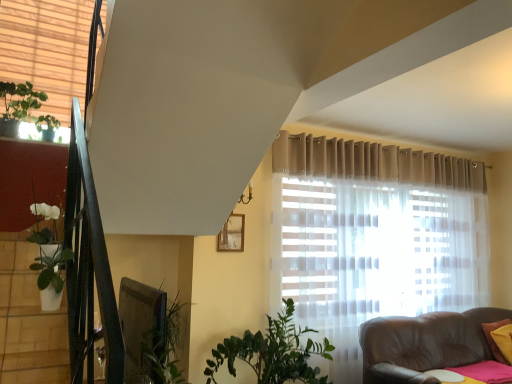
Question: Can you confirm if yellow fabric pillow at lower right is bigger than wooden frame at upper center?

Choices:
 (A) yes
 (B) no

Answer: (A)

Question: Is wooden frame at upper center a part of yellow fabric pillow at lower right?

Choices:
 (A) yes
 (B) no

Answer: (B)

Question: Does yellow fabric pillow at lower right come behind wooden frame at upper center?

Choices:
 (A) no
 (B) yes

Answer: (B)

Question: From a real-world perspective, is yellow fabric pillow at lower right physically below wooden frame at upper center?

Choices:
 (A) yes
 (B) no

Answer: (A)

Question: From the image's perspective, is yellow fabric pillow at lower right under wooden frame at upper center?

Choices:
 (A) yes
 (B) no

Answer: (A)

Question: In terms of size, does wooden frame at upper center appear bigger or smaller than green matte plant at upper left?

Choices:
 (A) big
 (B) small

Answer: (B)

Question: Choose the correct answer: Is wooden frame at upper center inside green matte plant at upper left or outside it?

Choices:
 (A) inside
 (B) outside

Answer: (B)

Question: Is wooden frame at upper center to the left or to the right of green matte plant at upper left in the image?

Choices:
 (A) left
 (B) right

Answer: (B)

Question: Is wooden frame at upper center in front of or behind green matte plant at upper left in the image?

Choices:
 (A) behind
 (B) front

Answer: (A)

Question: Based on their sizes in the image, would you say yellow fabric pillow at lower right is bigger or smaller than beige fabric blinds at upper left?

Choices:
 (A) small
 (B) big

Answer: (A)

Question: Considering the positions of yellow fabric pillow at lower right and beige fabric blinds at upper left in the image, is yellow fabric pillow at lower right taller or shorter than beige fabric blinds at upper left?

Choices:
 (A) short
 (B) tall

Answer: (A)

Question: Based on their positions, is yellow fabric pillow at lower right located to the left or right of beige fabric blinds at upper left?

Choices:
 (A) left
 (B) right

Answer: (B)

Question: From the image's perspective, relative to beige fabric blinds at upper left, is yellow fabric pillow at lower right above or below?

Choices:
 (A) below
 (B) above

Answer: (A)

Question: Based on their sizes in the image, would you say beige fabric blinds at upper left is bigger or smaller than white glossy pot at left?

Choices:
 (A) big
 (B) small

Answer: (A)

Question: Considering the positions of point (2, 100) and point (30, 241), is point (2, 100) closer or farther from the camera than point (30, 241)?

Choices:
 (A) farther
 (B) closer

Answer: (A)